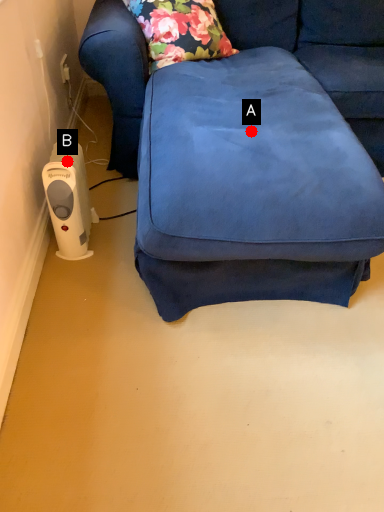
Question: Two points are circled on the image, labeled by A and B beside each circle. Among these points, which one is nearest to the camera?

Choices:
 (A) A is closer
 (B) B is closer

Answer: (A)